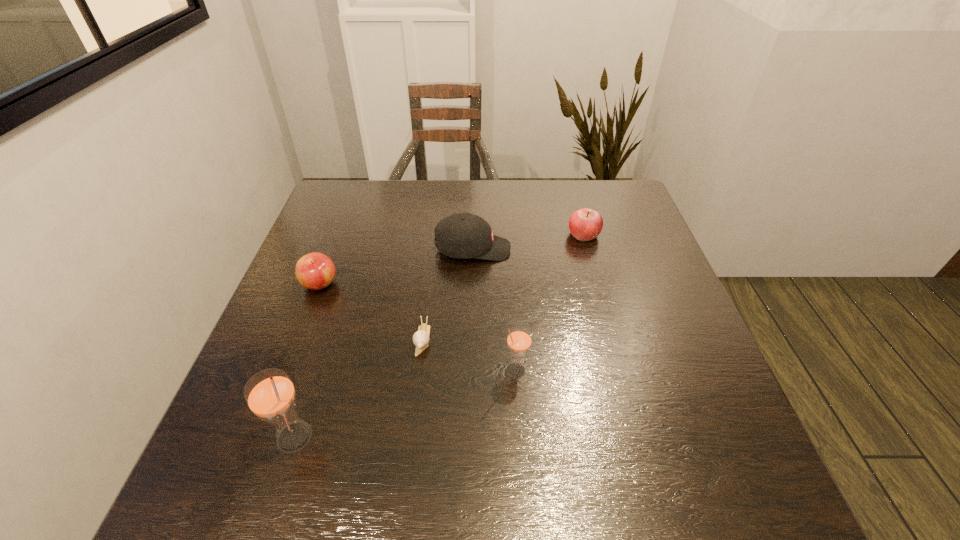
Where is `the taller straw`? The height and width of the screenshot is (540, 960). the taller straw is located at coordinates (270, 394).

The image size is (960, 540). Find the location of `the tallest object`. the tallest object is located at coordinates (270, 394).

What are the coordinates of `the fifth shortest object` in the screenshot? It's located at (519, 339).

Locate an element on the screen. the right straw is located at coordinates (519, 339).

Identify the location of the third tallest object. (464, 235).

The height and width of the screenshot is (540, 960). I want to click on the fourth nearest object, so click(315, 271).

This screenshot has height=540, width=960. Identify the location of the left apple. coord(315,271).

Find the location of a particular element. This screenshot has height=540, width=960. the right apple is located at coordinates (585, 224).

Locate an element on the screen. The width and height of the screenshot is (960, 540). the rightmost object is located at coordinates (585, 224).

Where is `the shortest object`? Image resolution: width=960 pixels, height=540 pixels. the shortest object is located at coordinates (421, 337).